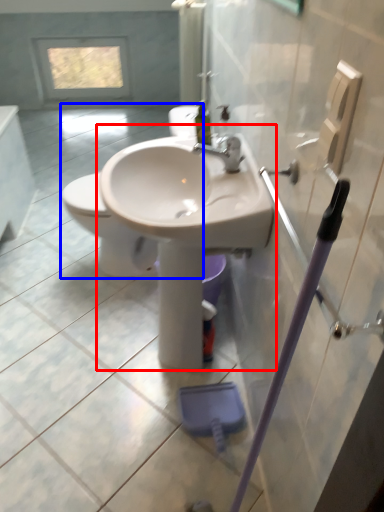
Question: Which of the following is the farthest to the observer, sink (highlighted by a red box) or toilet (highlighted by a blue box)?

Choices:
 (A) sink
 (B) toilet

Answer: (B)